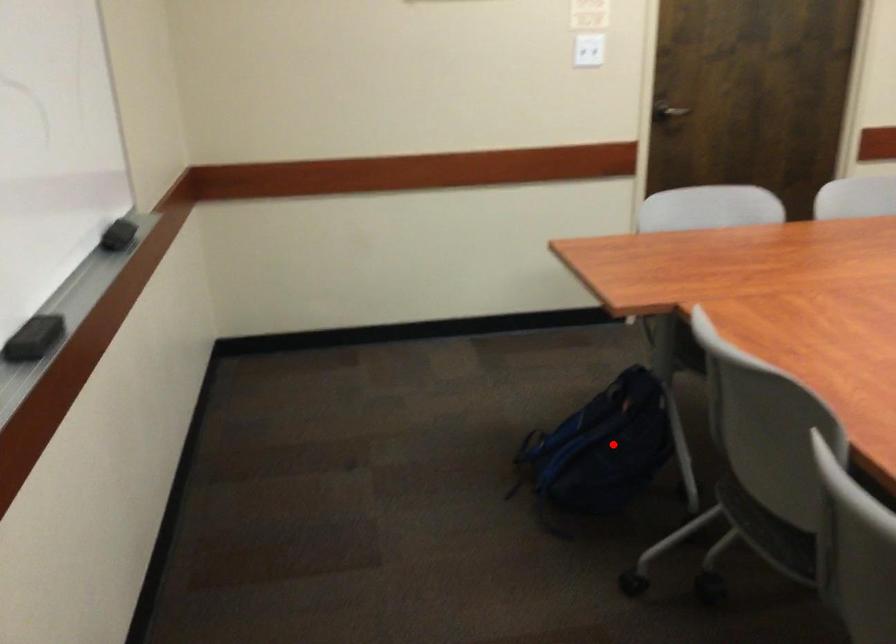
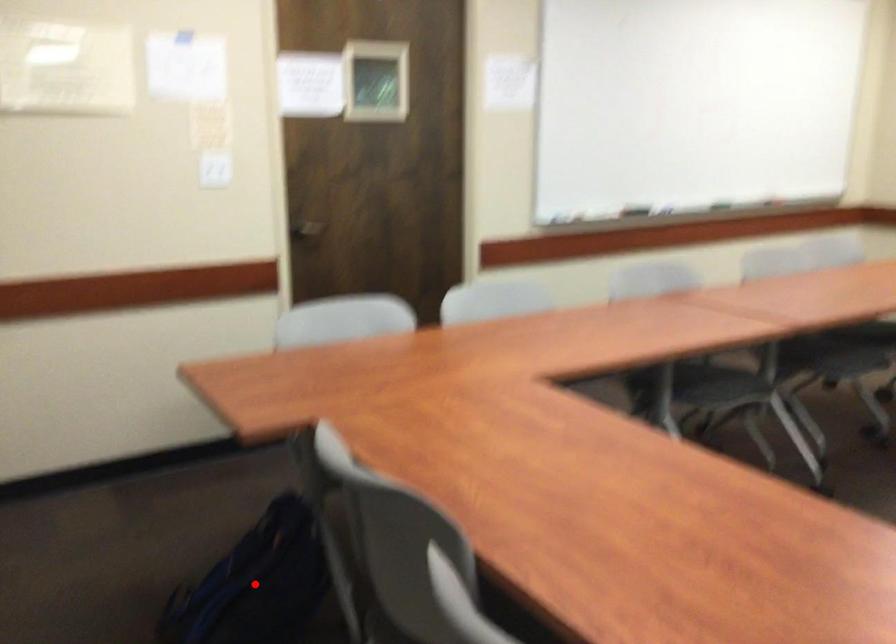
I am providing you with two images of the same scene from different viewpoints. A red point is marked on the first image and another point is marked on the second image. Are the points marked in image1 and image2 representing the same 3D position?

Yes